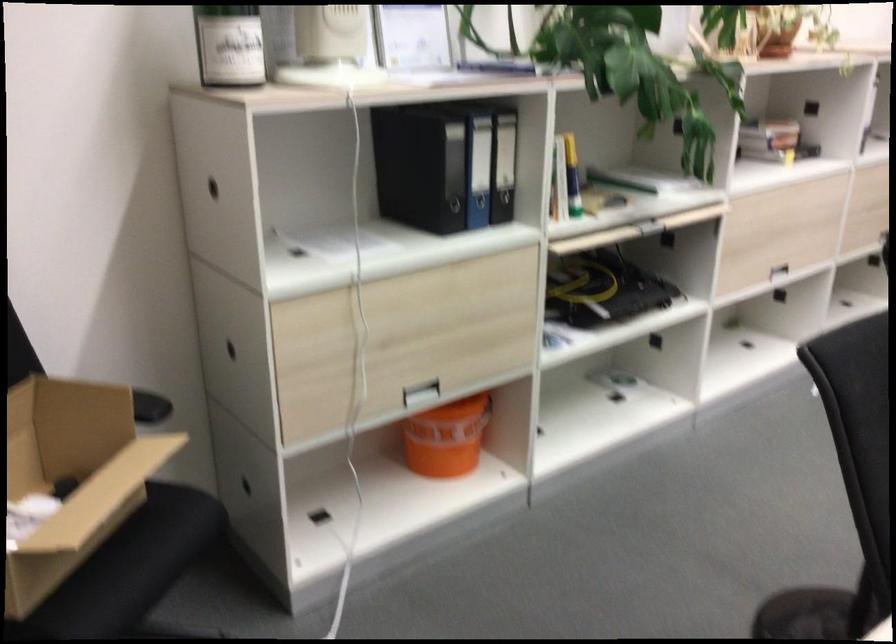
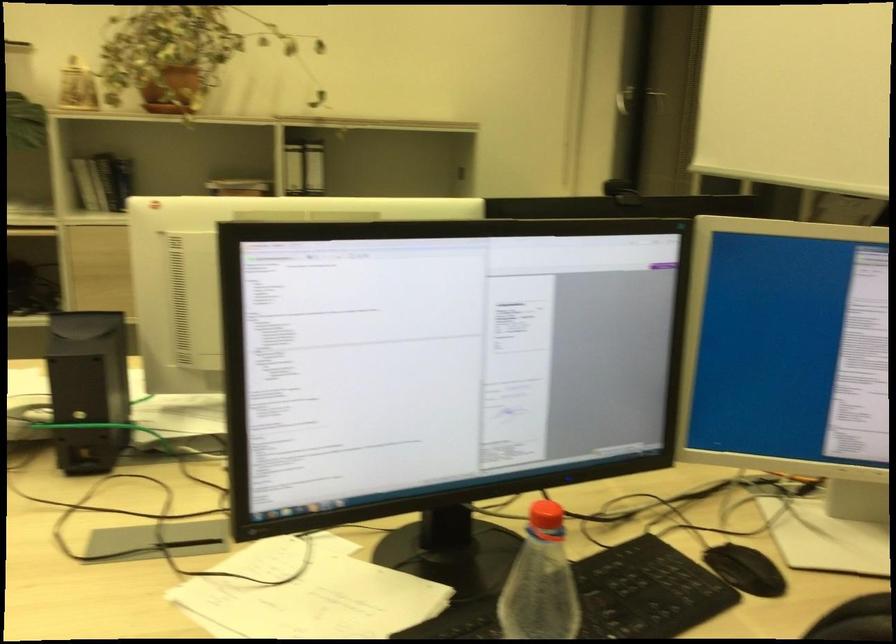
Question: The images are taken continuously from a first-person perspective. In which direction are you moving?

Choices:
 (A) Left
 (B) Right
 (C) Forward
 (D) Backward

Answer: (B)